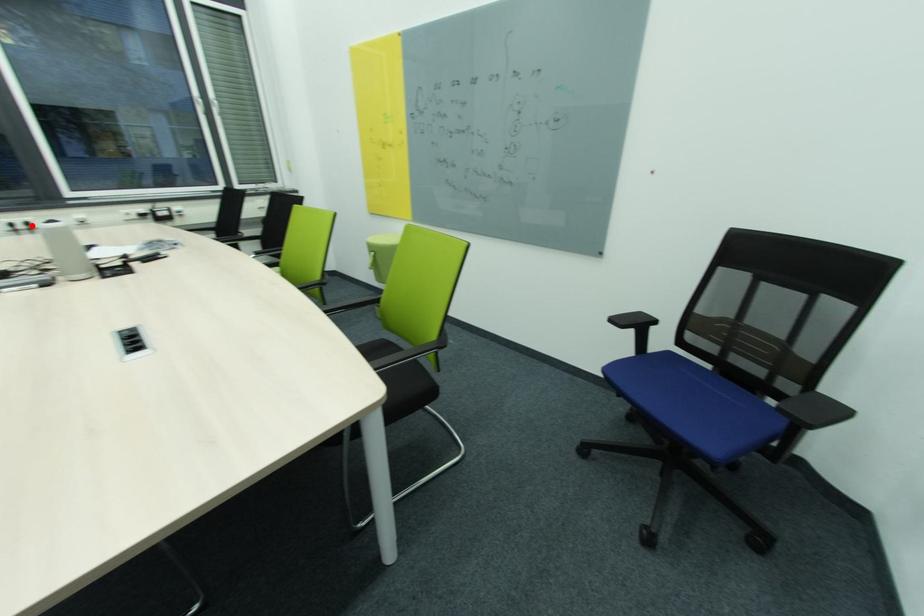
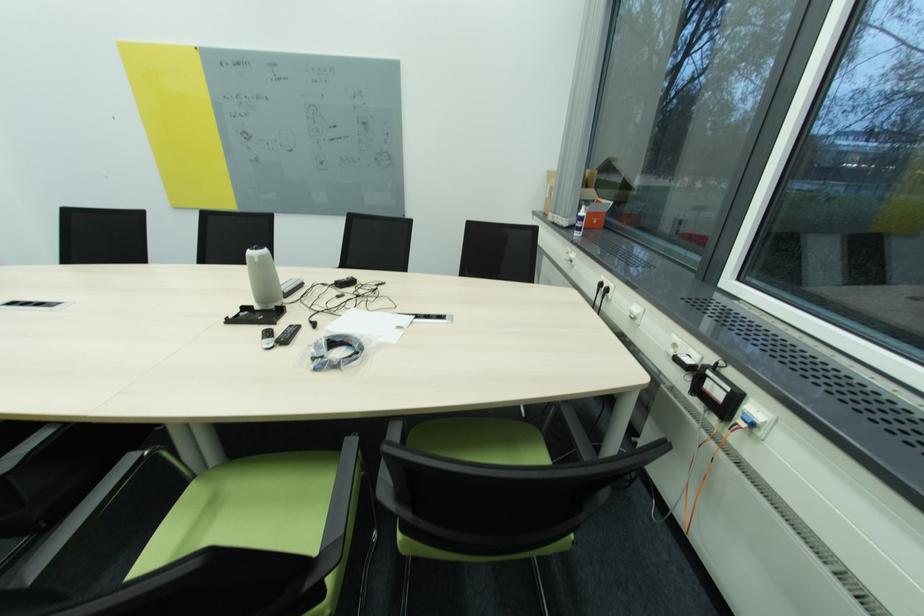
Find the pixel in the second image that matches the highlighted location in the first image.

(612, 291)